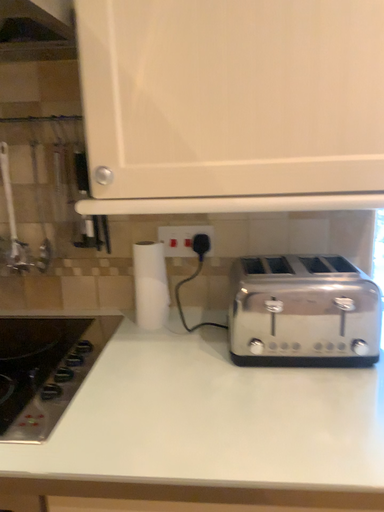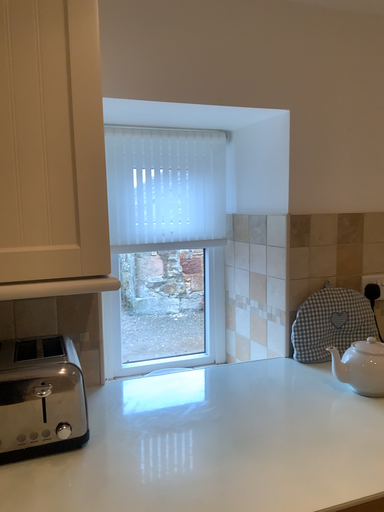
Question: Which way did the camera rotate in the video?

Choices:
 (A) rotated left
 (B) rotated right

Answer: (B)